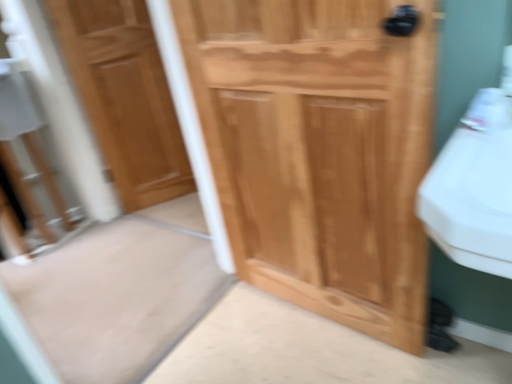
At what (x,y) coordinates should I click in order to perform the action: click on free point below natural wood cabinet at center, arranged as the 1th door when viewed from the front (from a real-world perspective). Please return your answer as a coordinate pair (x, y). Looking at the image, I should click on (320, 319).